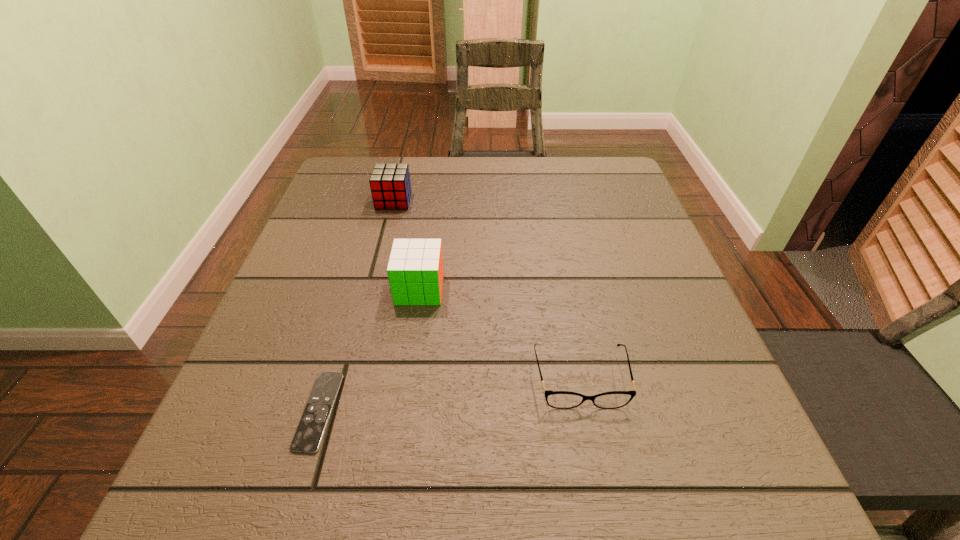
Locate an element on the screen. This screenshot has height=540, width=960. the second farthest object is located at coordinates (415, 271).

Identify the location of the third object from left to right. (415, 271).

The image size is (960, 540). I want to click on the farther cube, so (390, 184).

Where is `the farthest object`? The width and height of the screenshot is (960, 540). the farthest object is located at coordinates (390, 184).

Find the location of `spectacles`. spectacles is located at coordinates (556, 399).

In order to click on the second shortest object in this screenshot , I will do `click(556, 399)`.

You are a GUI agent. You are given a task and a screenshot of the screen. Output one action in this format:
    pyautogui.click(x=<x>, y=<y>)
    Task: Click on the shortest object
    The image size is (960, 540).
    Given the screenshot: What is the action you would take?
    pyautogui.click(x=310, y=431)

Where is `free space located 0.080m on the front of the second farthest object`? free space located 0.080m on the front of the second farthest object is located at coordinates (413, 338).

The width and height of the screenshot is (960, 540). Identify the location of free region located on the right of the farthest object. (540, 201).

The height and width of the screenshot is (540, 960). I want to click on vacant space positioned on the front-facing side of the second shortest object, so click(x=603, y=496).